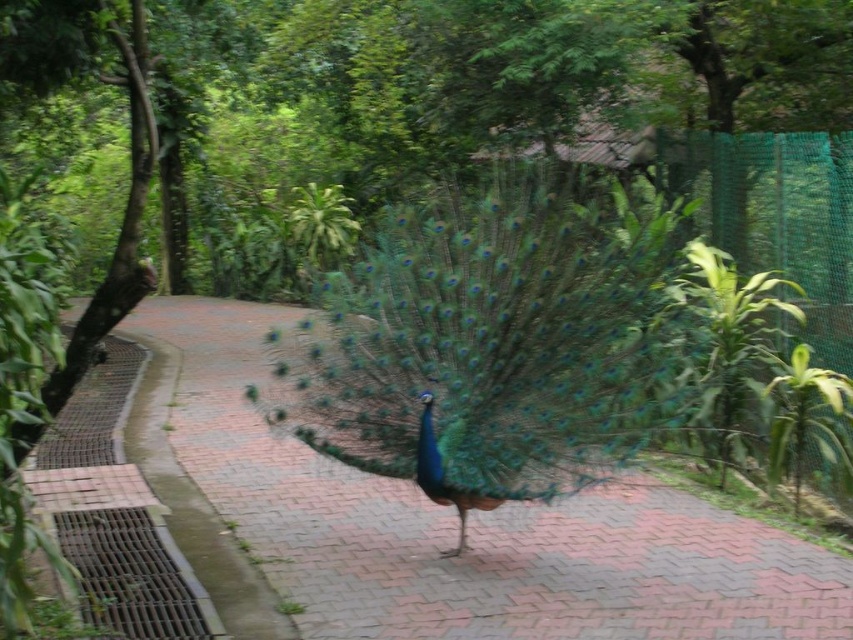
Question: Is shiny blue peacock at center bigger than brick pavement at center?

Choices:
 (A) yes
 (B) no

Answer: (B)

Question: Does shiny blue peacock at center appear under brick pavement at center?

Choices:
 (A) yes
 (B) no

Answer: (B)

Question: Can you confirm if shiny blue peacock at center is positioned below brick pavement at center?

Choices:
 (A) yes
 (B) no

Answer: (B)

Question: Which of the following is the closest to the observer?

Choices:
 (A) shiny blue peacock at center
 (B) brick pavement at center

Answer: (B)